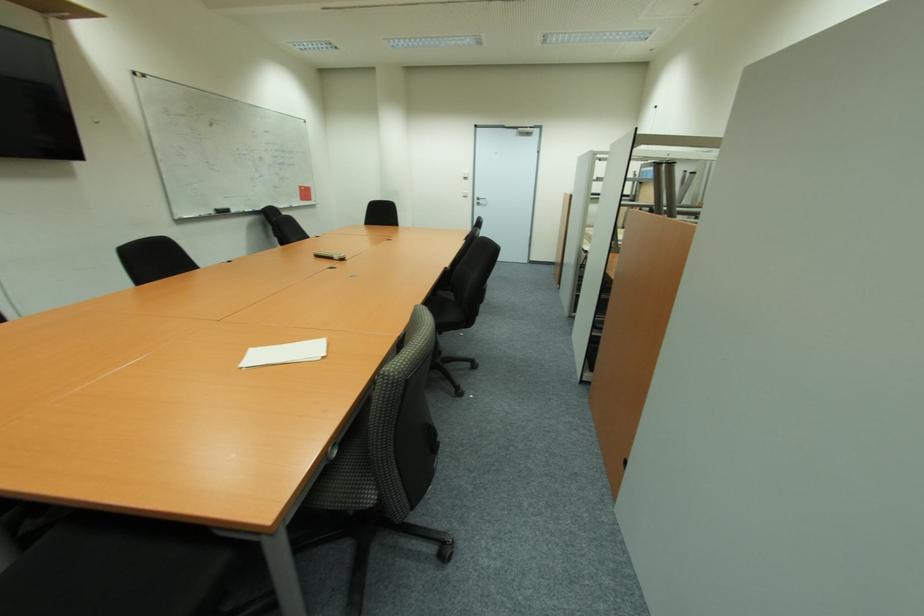
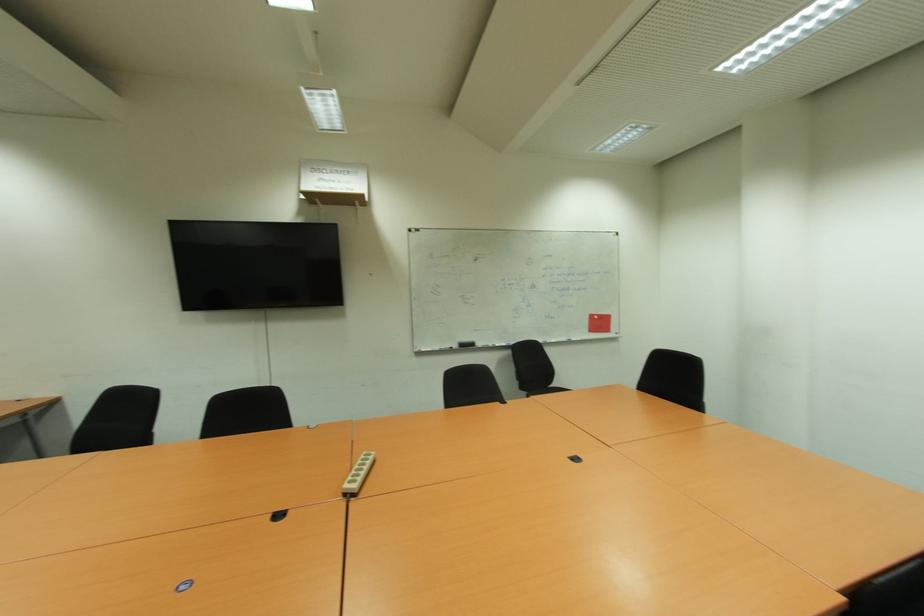
Where in the second image is the point corresponding to (x=215, y=214) from the first image?

(457, 347)